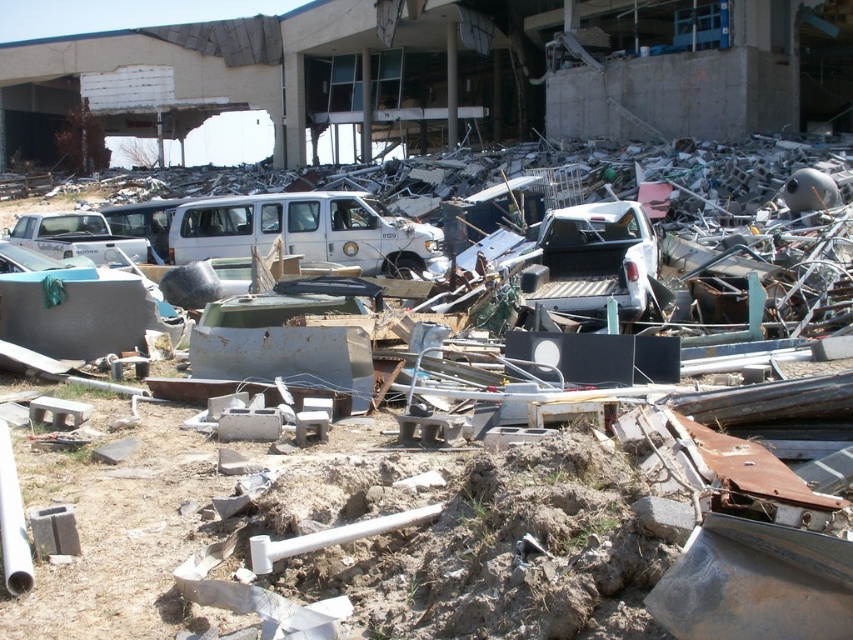
Which is behind, point (180, 237) or point (48, 221)?

The point (48, 221) is more distant.

Who is positioned more to the left, white matte van at center or matte white truck at left?

matte white truck at left

Where is `white matte van at center`? Image resolution: width=853 pixels, height=640 pixels. white matte van at center is located at coordinates pos(306,230).

Is white matte truck at center below matte white truck at left?

Indeed, white matte truck at center is positioned under matte white truck at left.

Is white matte truck at center positioned behind matte white truck at left?

That is False.

Is point (538, 269) less distant than point (126, 241)?

Yes, it is in front of point (126, 241).

Locate an element on the screen. This screenshot has width=853, height=640. white matte truck at center is located at coordinates (593, 268).

Does white matte van at center have a smaller size compared to white matte truck at center?

No, white matte van at center is not smaller than white matte truck at center.

Does white matte van at center appear on the left side of white matte truck at center?

Indeed, white matte van at center is positioned on the left side of white matte truck at center.

Which is in front, point (233, 240) or point (540, 304)?

Point (540, 304) is in front.

Locate an element on the screen. The height and width of the screenshot is (640, 853). white matte van at center is located at coordinates (306, 230).